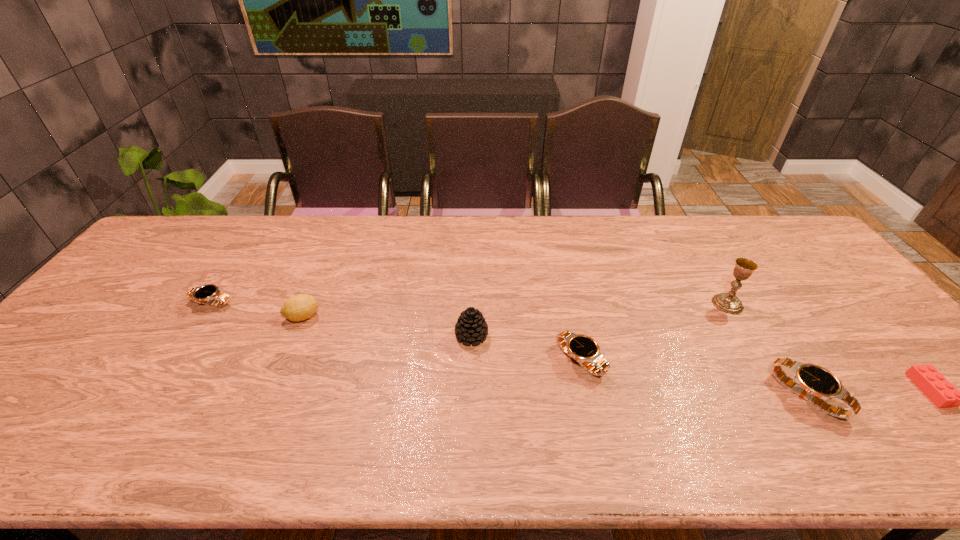
This screenshot has height=540, width=960. Identify the location of the leftmost watch. [204, 294].

Where is `the sixth tallest object`? Image resolution: width=960 pixels, height=540 pixels. the sixth tallest object is located at coordinates (204, 294).

Where is `the second tallest watch`? This screenshot has width=960, height=540. the second tallest watch is located at coordinates (581, 348).

Where is `the second watch from right to left`? The width and height of the screenshot is (960, 540). the second watch from right to left is located at coordinates (581, 348).

Identify the location of the rightmost watch. The image size is (960, 540). (811, 382).

What are the coordinates of `pinecone` in the screenshot? It's located at (471, 326).

Identify the location of the fifth object from right to left. (471, 326).

The height and width of the screenshot is (540, 960). What are the coordinates of `lemon` in the screenshot? It's located at (300, 307).

Find the location of a particular element. chalice is located at coordinates (727, 302).

Locate an element on the screen. This screenshot has height=540, width=960. the shortest object is located at coordinates (930, 381).